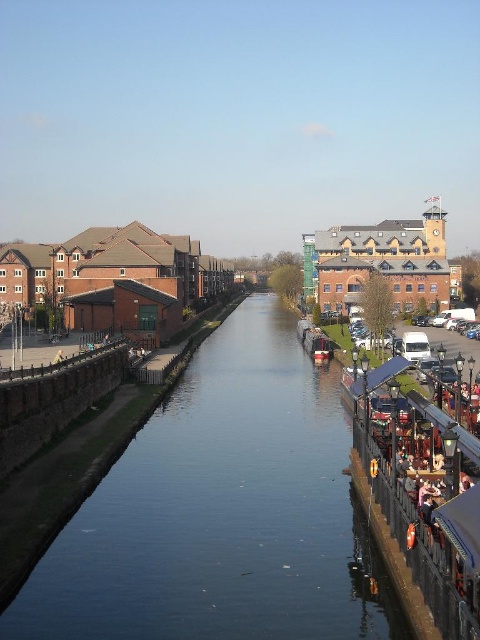
Is point (227, 497) closer to camera compared to point (315, 326)?

Yes, it is in front of point (315, 326).

Between blue smooth canal at center and shiny red boat at center, which one has less height?

Standing shorter between the two is shiny red boat at center.

Where is `blue smooth canal at center`? This screenshot has width=480, height=640. blue smooth canal at center is located at coordinates (222, 513).